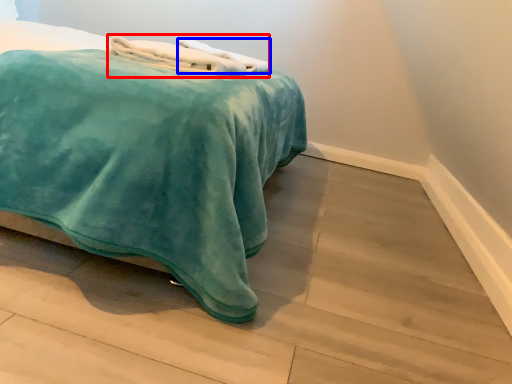
Question: Which point is further to the camera, bath towel (highlighted by a red box) or bath towel (highlighted by a blue box)?

Choices:
 (A) bath towel
 (B) bath towel

Answer: (B)